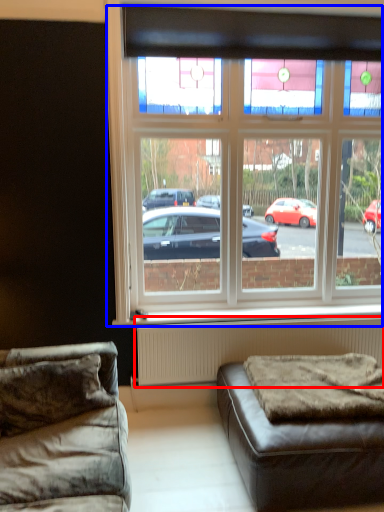
Question: Which of the following is the closest to the observer, radiator (highlighted by a red box) or window (highlighted by a blue box)?

Choices:
 (A) radiator
 (B) window

Answer: (B)